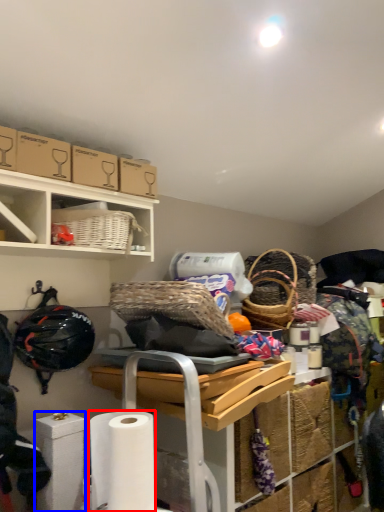
Question: Which point is closer to the camera, toilet paper (highlighted by a red box) or toilet paper (highlighted by a blue box)?

Choices:
 (A) toilet paper
 (B) toilet paper

Answer: (A)